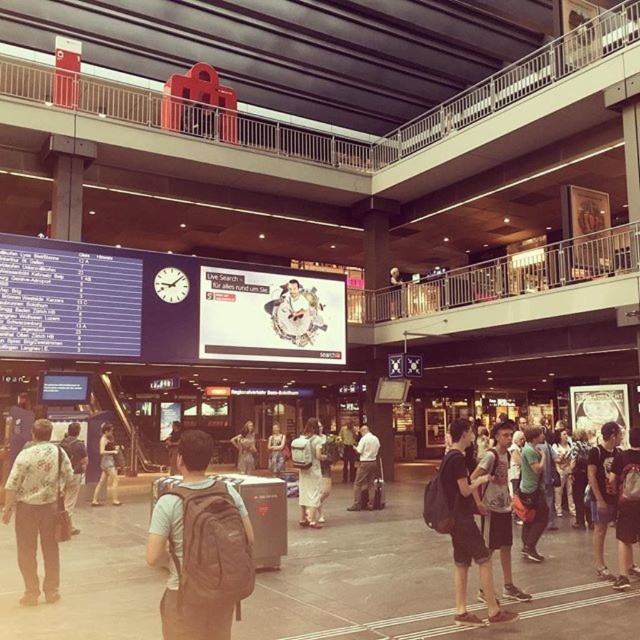
You are standing in the transportation hub and see a person wearing a floral shirt at center and denim shorts at center. Which clothing item is positioned to the right?

The floral shirt at center is positioned to the right of the denim shorts at center.